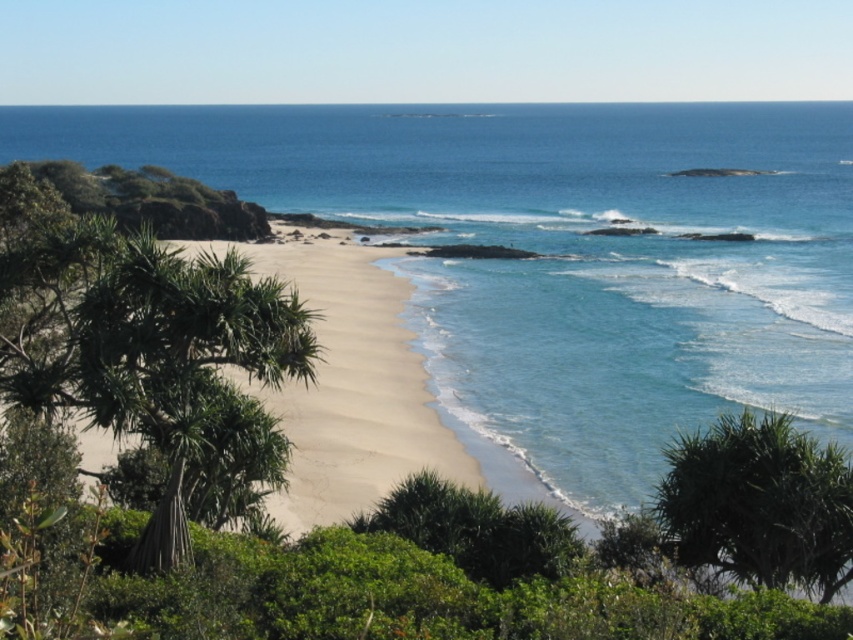
Question: Can you confirm if blue clear water at center is positioned to the left of light beige sand at center?

Choices:
 (A) no
 (B) yes

Answer: (A)

Question: Which object appears closest to the camera in this image?

Choices:
 (A) light beige sand at center
 (B) blue clear water at center

Answer: (A)

Question: Among these objects, which one is farthest from the camera?

Choices:
 (A) blue clear water at center
 (B) light beige sand at center

Answer: (A)

Question: Does blue clear water at center appear over light beige sand at center?

Choices:
 (A) yes
 (B) no

Answer: (A)

Question: Is blue clear water at center in front of light beige sand at center?

Choices:
 (A) yes
 (B) no

Answer: (B)